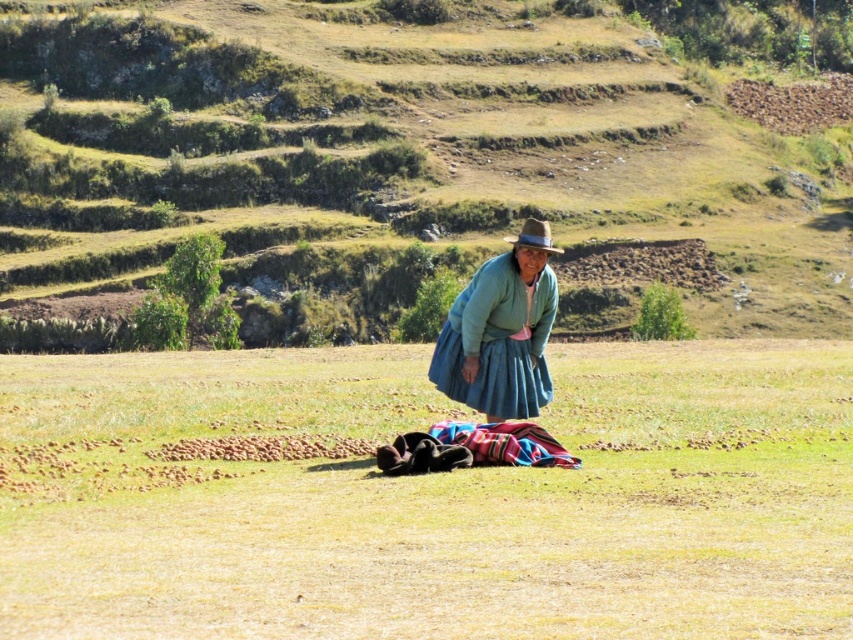
You are standing at the center of the field and want to place a new scarecrow exactly 2 meters north of the multicolored woven cloth at center. According to the coordinates provided, where should you place the scarecrow?

The multicolored woven cloth at center is located at point (505,444). To place the scarecrow 2 meters north, you would need to adjust the y coordinate by adding 2 meters, resulting in the new coordinates being approximately (505,444) plus 2 meters north. However, without knowing the scale of the coordinate system, an exact placement isn

You are a hiker who wants to place a heavy backpack on the multicolored woven cloth at center without it slipping onto the green grassy hillside at center. Is the cloth positioned in a way that allows this?

The green grassy hillside at center is positioned over the multicolored woven cloth at center, meaning the cloth is lower than the hillside. Therefore, placing the backpack on the cloth would not cause it to slip onto the hillside since the cloth is already positioned below the hillside.